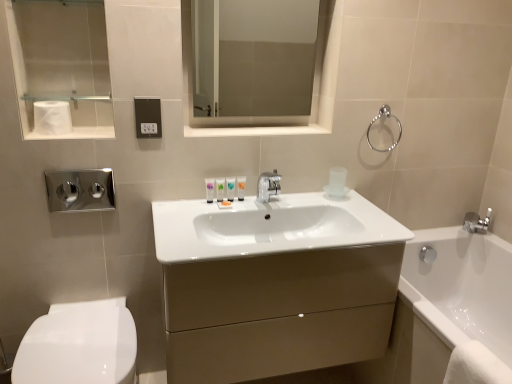
This screenshot has width=512, height=384. Find the location of `free space above matte beige cabinet at center (from a real-world perspective)`. free space above matte beige cabinet at center (from a real-world perspective) is located at coordinates (262, 207).